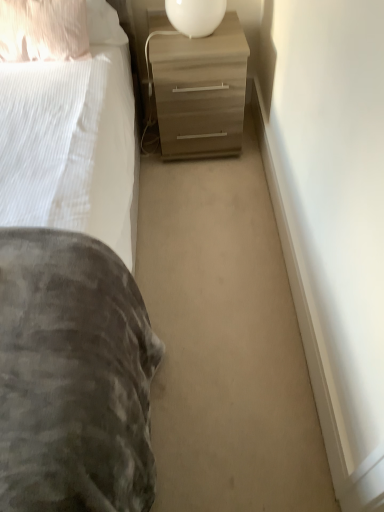
The height and width of the screenshot is (512, 384). I want to click on free space above matte wood chest of drawers at center (from a real-world perspective), so click(x=193, y=40).